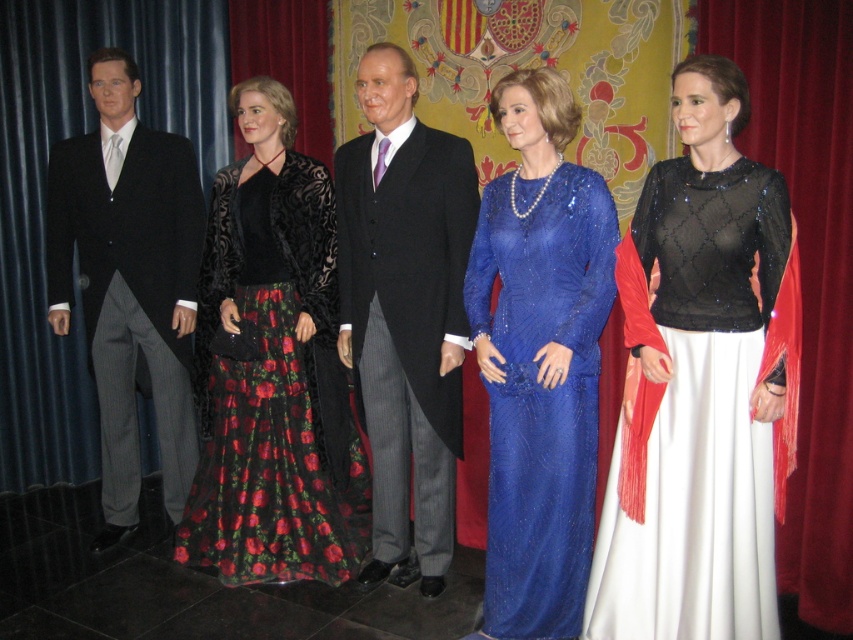
In the scene shown: You are standing in front of the image and want to determine which of the two points, point (612, 548) or point (167, 177), is nearer to you. Based on the scene description, which point is closer?

Point (612, 548) is closer to the camera than point (167, 177), so it is the nearer point.

You are organizing a fashion show and need to arrange the black sequined dress at center and the matte black suit at left on a narrow runway. Which outfit can fit better in a space that is only 1 meter wide?

The black sequined dress at center has a smaller width than the matte black suit at left, so it can fit better in a 1 meter wide space.